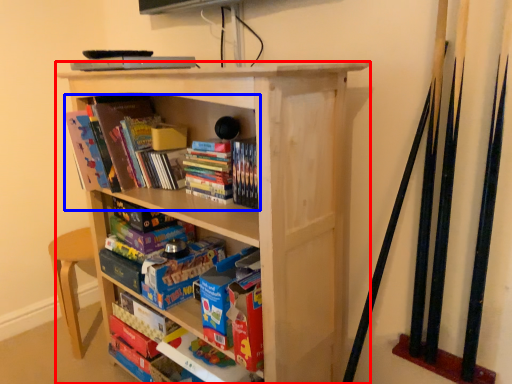
Question: Which of the following is the closest to the observer, bookcase (highlighted by a red box) or book (highlighted by a blue box)?

Choices:
 (A) bookcase
 (B) book

Answer: (A)